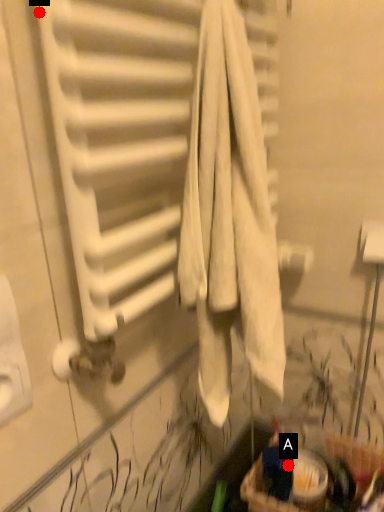
Question: Two points are circled on the image, labeled by A and B beside each circle. Which of the following is the farthest from the observer?

Choices:
 (A) A is further
 (B) B is further

Answer: (A)